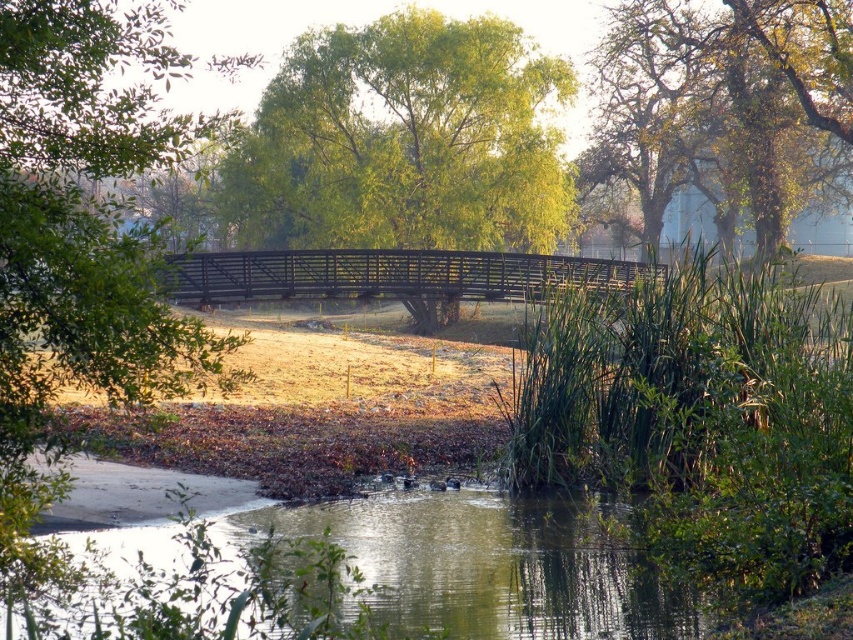
Measure the distance between point (474, 195) and camera.

A distance of 53.42 meters exists between point (474, 195) and camera.

Does green leafy tree at center appear on the left side of wooden bridge at center?

Incorrect, green leafy tree at center is not on the left side of wooden bridge at center.

Is point (277, 188) closer to camera compared to point (572, 264)?

No, it is not.

Identify the location of green leafy tree at center. This screenshot has height=640, width=853. (405, 140).

Consider the image. Is green leafy tree at center to the right of green leafy tree at upper right from the viewer's perspective?

Incorrect, green leafy tree at center is not on the right side of green leafy tree at upper right.

Which of these two, green leafy tree at center or green leafy tree at upper right, stands shorter?

Standing shorter between the two is green leafy tree at center.

Locate an element on the screen. The image size is (853, 640). green leafy tree at center is located at coordinates (405, 140).

Can you confirm if green leafy tree at left is shorter than green leafy tree at upper right?

Incorrect, green leafy tree at left's height does not fall short of green leafy tree at upper right's.

Is green leafy tree at left wider than green leafy tree at upper right?

No, green leafy tree at left is not wider than green leafy tree at upper right.

Between point (77, 144) and point (809, 115), which one is positioned in front?

Point (77, 144) is more forward.

I want to click on green leafy tree at left, so click(x=80, y=236).